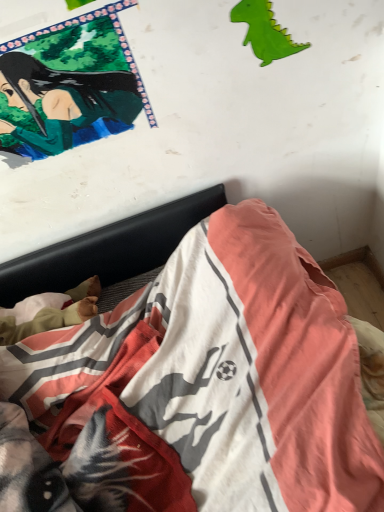
You are a GUI agent. You are given a task and a screenshot of the screen. Output one action in this format:
    pyautogui.click(x=<x>, y=<y>)
    Task: Click on the green paper dinosaur at upper right
    The image size is (384, 512).
    Given the screenshot: What is the action you would take?
    pyautogui.click(x=264, y=31)

Locate an element on the screen. The width and height of the screenshot is (384, 512). green paper dinosaur at upper right is located at coordinates (264, 31).

Between green paper dinosaur at upper right and green glossy poster at upper left, which one has smaller size?

With smaller size is green paper dinosaur at upper right.

Which is further, (244,7) or (41,83)?

Positioned behind is point (41,83).

From the image's perspective, is green paper dinosaur at upper right positioned above or below green glossy poster at upper left?

green paper dinosaur at upper right is above green glossy poster at upper left.

From a real-world perspective, which is physically below, green paper dinosaur at upper right or green glossy poster at upper left?

green paper dinosaur at upper right is physically lower.

Considering the relative positions of green glossy poster at upper left and cotton bedspread at lower center in the image provided, is green glossy poster at upper left in front of cotton bedspread at lower center?

No, it is behind cotton bedspread at lower center.

From a real-world perspective, is green glossy poster at upper left above or below cotton bedspread at lower center?

From a real-world perspective, green glossy poster at upper left is physically above cotton bedspread at lower center.

Between green glossy poster at upper left and cotton bedspread at lower center, which one has larger size?

cotton bedspread at lower center.

From the image's perspective, which is below, green glossy poster at upper left or cotton bedspread at lower center?

cotton bedspread at lower center.

Can you confirm if cotton bedspread at lower center is thinner than green glossy poster at upper left?

No, cotton bedspread at lower center is not thinner than green glossy poster at upper left.

From the image's perspective, is cotton bedspread at lower center above or below green glossy poster at upper left?

Clearly, from the image's perspective, cotton bedspread at lower center is below green glossy poster at upper left.

From a real-world perspective, is cotton bedspread at lower center located higher than green glossy poster at upper left?

No, from a real-world perspective, cotton bedspread at lower center is not on top of green glossy poster at upper left.

Which is more to the left, cotton bedspread at lower center or green glossy poster at upper left?

green glossy poster at upper left is more to the left.

Identify the location of person in front of the green paper dinosaur at upper right. (63, 104).

From a real-world perspective, is green glossy poster at upper left positioned over green paper dinosaur at upper right based on gravity?

Yes, from a real-world perspective, green glossy poster at upper left is over green paper dinosaur at upper right

Is green glossy poster at upper left in front of or behind green paper dinosaur at upper right in the image?

In the image, green glossy poster at upper left appears in front of green paper dinosaur at upper right.

Is green paper dinosaur at upper right not within cotton bedspread at lower center?

Yes, green paper dinosaur at upper right is located beyond the bounds of cotton bedspread at lower center.

Is green paper dinosaur at upper right taller than cotton bedspread at lower center?

No, green paper dinosaur at upper right is not taller than cotton bedspread at lower center.

Is green paper dinosaur at upper right thinner than cotton bedspread at lower center?

Correct, the width of green paper dinosaur at upper right is less than that of cotton bedspread at lower center.

Measure the distance between cotton bedspread at lower center and green paper dinosaur at upper right.

cotton bedspread at lower center and green paper dinosaur at upper right are 24.87 inches apart.

Identify the location of bed that is below the green paper dinosaur at upper right (from the image's perspective). Image resolution: width=384 pixels, height=512 pixels. (200, 389).

From a real-world perspective, is cotton bedspread at lower center positioned above or below green paper dinosaur at upper right?

From a real-world perspective, cotton bedspread at lower center is physically below green paper dinosaur at upper right.

Is cotton bedspread at lower center at the left side of green paper dinosaur at upper right?

Correct, you'll find cotton bedspread at lower center to the left of green paper dinosaur at upper right.

In order to click on person that appears below the green paper dinosaur at upper right (from the image's perspective) in this screenshot , I will do `click(63, 104)`.

Where is `person positioned vertically above the cotton bedspread at lower center (from a real-world perspective)`? The image size is (384, 512). person positioned vertically above the cotton bedspread at lower center (from a real-world perspective) is located at coordinates (63, 104).

From the image, which object appears to be farther from green glossy poster at upper left, cotton bedspread at lower center or green paper dinosaur at upper right?

cotton bedspread at lower center lies further to green glossy poster at upper left than the other object.

Estimate the real-world distances between objects in this image. Which object is closer to green paper dinosaur at upper right, cotton bedspread at lower center or green glossy poster at upper left?

The object closer to green paper dinosaur at upper right is green glossy poster at upper left.

Looking at this image, when comparing their distances from cotton bedspread at lower center, does green glossy poster at upper left or green paper dinosaur at upper right seem further?

green paper dinosaur at upper right lies further to cotton bedspread at lower center than the other object.

Looking at the image, which one is located further to cotton bedspread at lower center, green paper dinosaur at upper right or green glossy poster at upper left?

green paper dinosaur at upper right is positioned further to the anchor cotton bedspread at lower center.

Estimate the real-world distances between objects in this image. Which object is further from green glossy poster at upper left, green paper dinosaur at upper right or cotton bedspread at lower center?

The object further to green glossy poster at upper left is cotton bedspread at lower center.

From the image, which object appears to be farther from green paper dinosaur at upper right, green glossy poster at upper left or cotton bedspread at lower center?

Among the two, cotton bedspread at lower center is located further to green paper dinosaur at upper right.

You are a GUI agent. You are given a task and a screenshot of the screen. Output one action in this format:
    pyautogui.click(x=<x>, y=<y>)
    Task: Click on the person between green paper dinosaur at upper right and cotton bedspread at lower center vertically
    This screenshot has width=384, height=512.
    Given the screenshot: What is the action you would take?
    pyautogui.click(x=63, y=104)